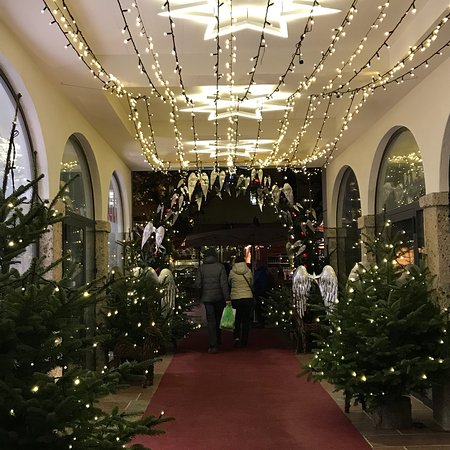
You are a GUI agent. You are given a task and a screenshot of the screen. Output one action in this format:
    pyautogui.click(x=<x>, y=<y>)
    Task: Click on the tile on sides of red carpet
    
    Given the screenshot: What is the action you would take?
    pyautogui.click(x=130, y=397), pyautogui.click(x=388, y=439)